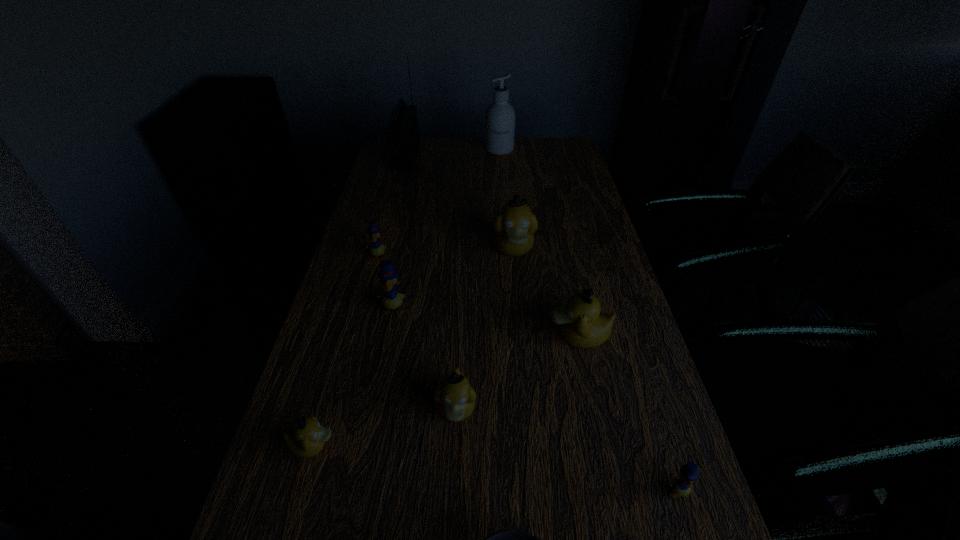
This screenshot has height=540, width=960. I want to click on vacant space at the left edge of the desktop, so click(x=342, y=315).

The image size is (960, 540). Find the location of `free region at the right edge of the desktop`. free region at the right edge of the desktop is located at coordinates (572, 185).

Locate an element on the screen. The image size is (960, 540). vacant space at the far right corner of the desktop is located at coordinates (558, 162).

You are a GUI agent. You are given a task and a screenshot of the screen. Output one action in this format:
    pyautogui.click(x=<x>, y=<y>)
    Task: Click on the free space that is in between the third biggest tan duckling and the nearest duckling
    The image size is (960, 540).
    Given the screenshot: What is the action you would take?
    pyautogui.click(x=566, y=450)

This screenshot has width=960, height=540. In order to click on unoccupied position between the ninth farthest object and the eighth shortest object in this screenshot , I will do tap(595, 370).

Find the location of a particular element. Image resolution: width=960 pixels, height=540 pixels. unoccupied position between the biggest yellow duckling and the second smallest tan duckling is located at coordinates (424, 359).

Locate an element on the screen. This screenshot has height=540, width=960. vacant space that is in between the fourth duckling from right to left and the ninth farthest object is located at coordinates (566, 450).

Locate an element on the screen. empty space between the leftmost yellow duckling and the fourth nearest duckling is located at coordinates (478, 296).

This screenshot has width=960, height=540. Identify the location of vacant region between the gray radio receiver and the fifth duckling from right to left. (399, 233).

Identify the location of free point between the third nearest tan duckling and the fourth duckling from left to right. (517, 373).